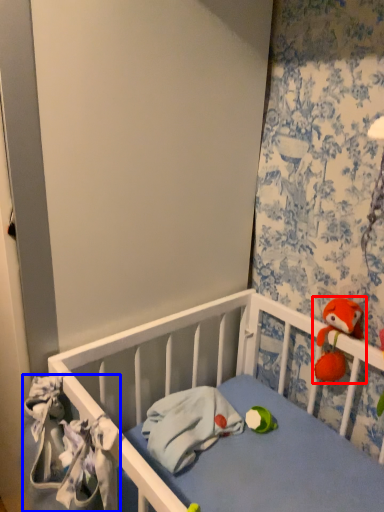
Question: Which of the following is the farthest to the observer, toy (highlighted by a red box) or material (highlighted by a blue box)?

Choices:
 (A) toy
 (B) material

Answer: (A)